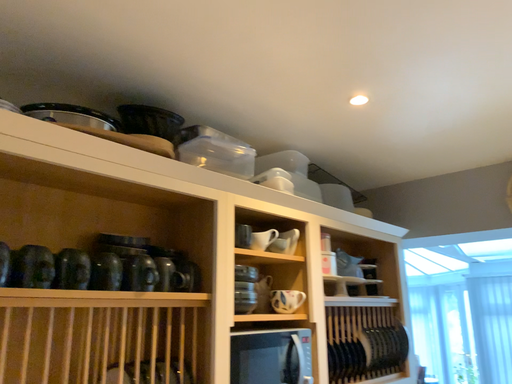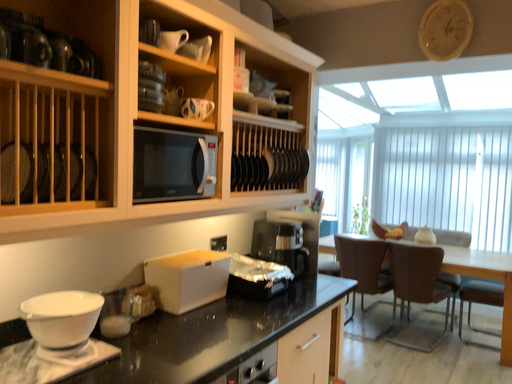
Question: How did the camera likely rotate when shooting the video?

Choices:
 (A) rotated right
 (B) rotated left

Answer: (A)